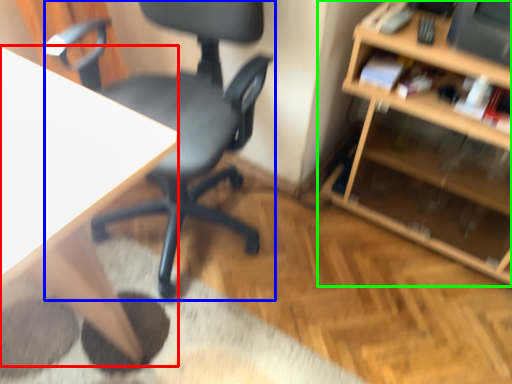
Question: Which object is the farthest from desk (highlighted by a red box)? Choose among these: chair (highlighted by a blue box) or shelf (highlighted by a green box).

Choices:
 (A) chair
 (B) shelf

Answer: (B)